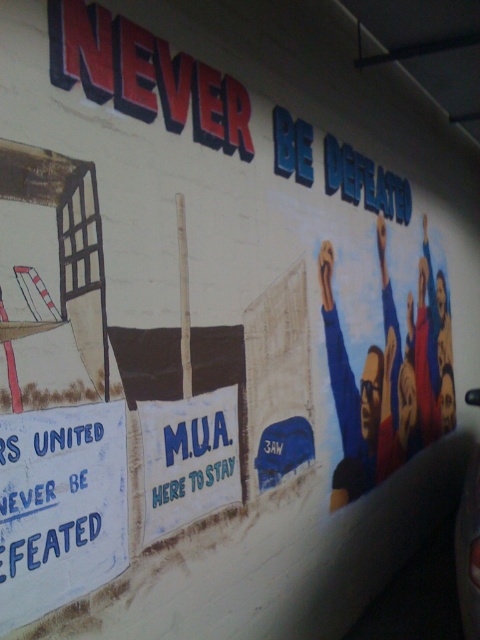
Question: Which of the following is the farthest from the observer?

Choices:
 (A) blue fabric sign at center
 (B) blue painted sign at lower left

Answer: (A)

Question: Among these objects, which one is nearest to the camera?

Choices:
 (A) blue painted sign at lower left
 (B) blue fabric sign at center

Answer: (A)

Question: Where is blue painted sign at lower left located in relation to blue fabric sign at center in the image?

Choices:
 (A) above
 (B) below

Answer: (B)

Question: Which object appears farthest from the camera in this image?

Choices:
 (A) blue fabric sign at center
 (B) blue painted sign at lower left

Answer: (A)

Question: Does blue painted sign at lower left lie behind blue fabric sign at center?

Choices:
 (A) yes
 (B) no

Answer: (B)

Question: Where is blue painted sign at lower left located in relation to blue fabric sign at center in the image?

Choices:
 (A) below
 (B) above

Answer: (A)